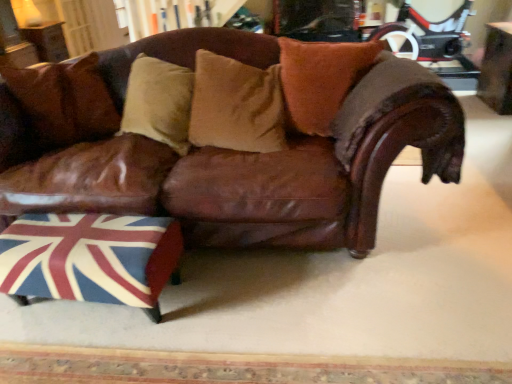
Question: Considering the positions of wooden table at upper left, the 2th table in the bottom-to-top sequence, and brown suede pillow at center, marked as the 1th pillow in a right-to-left arrangement, in the image, is wooden table at upper left, the 2th table in the bottom-to-top sequence, wider or thinner than brown suede pillow at center, marked as the 1th pillow in a right-to-left arrangement,?

Choices:
 (A) wide
 (B) thin

Answer: (A)

Question: Would you say wooden table at upper left, arranged as the 1th table when viewed from the top, is inside or outside brown suede pillow at center, the third pillow when ordered from left to right?

Choices:
 (A) outside
 (B) inside

Answer: (A)

Question: Considering the real-world distances, which object is closest to the brown suede pillow at center, the third pillow when ordered from left to right?

Choices:
 (A) wooden table at upper right, positioned as the 1th table in front-to-back order
 (B) union jack fabric ottoman at lower left
 (C) brown suede pillow at upper left, the first pillow from the left
 (D) wooden table at upper left, the first table from the left
 (E) brown leather couch at center

Answer: (E)

Question: Which object is the closest to the wooden table at upper left, arranged as the 1th table when viewed from the top?

Choices:
 (A) brown suede pillow at upper left, the first pillow from the left
 (B) wooden table at upper right, which ranks as the 1th table in right-to-left order
 (C) suede-like tan pillow at center, placed as the second pillow when sorted from right to left
 (D) brown suede pillow at center, marked as the 1th pillow in a right-to-left arrangement
 (E) union jack fabric ottoman at lower left

Answer: (A)